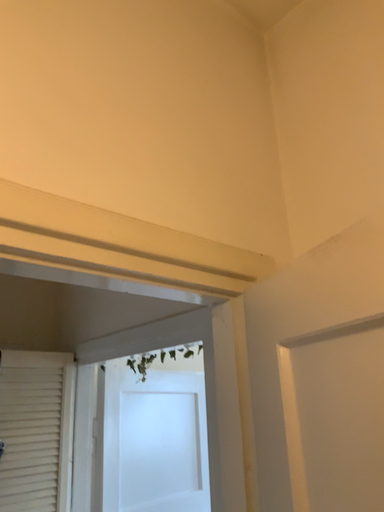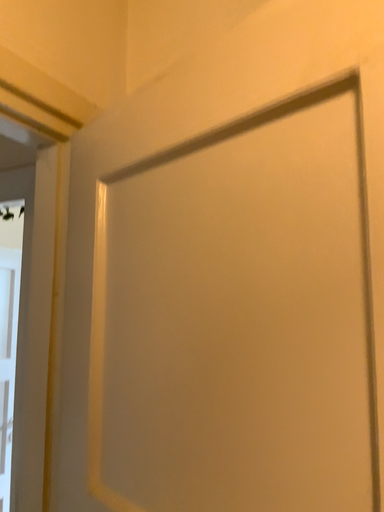
Question: Which way did the camera rotate in the video?

Choices:
 (A) rotated right
 (B) rotated left

Answer: (A)